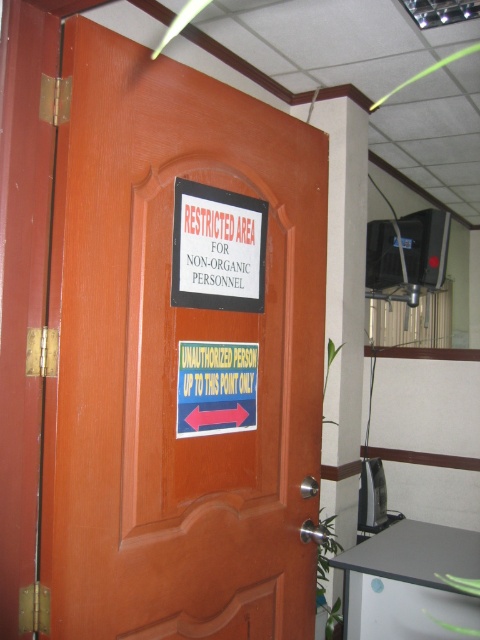
Can you confirm if brown wooden door at center is positioned above white paper sign at center?

Actually, brown wooden door at center is below white paper sign at center.

The image size is (480, 640). What are the coordinates of `brown wooden door at center` in the screenshot? It's located at (181, 358).

Identify the location of brown wooden door at center. The width and height of the screenshot is (480, 640). pyautogui.click(x=181, y=358).